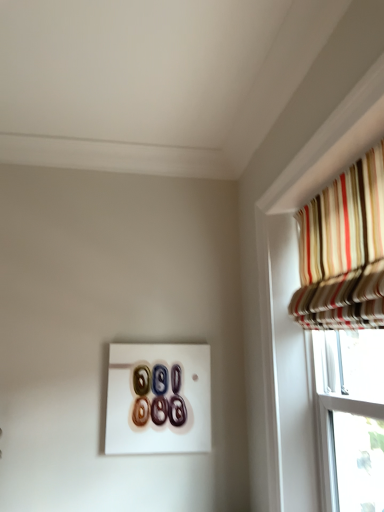
Question: Is glossy ceramic buttons at center touching striped fabric curtain at upper right?

Choices:
 (A) no
 (B) yes

Answer: (A)

Question: From a real-world perspective, is glossy ceramic buttons at center physically below striped fabric curtain at upper right?

Choices:
 (A) yes
 (B) no

Answer: (A)

Question: Considering the relative sizes of glossy ceramic buttons at center and striped fabric curtain at upper right in the image provided, is glossy ceramic buttons at center shorter than striped fabric curtain at upper right?

Choices:
 (A) no
 (B) yes

Answer: (B)

Question: Could striped fabric curtain at upper right be considered to be inside glossy ceramic buttons at center?

Choices:
 (A) yes
 (B) no

Answer: (B)

Question: Is glossy ceramic buttons at center taller than striped fabric curtain at upper right?

Choices:
 (A) no
 (B) yes

Answer: (A)

Question: Is the depth of glossy ceramic buttons at center less than that of striped fabric curtain at upper right?

Choices:
 (A) no
 (B) yes

Answer: (A)

Question: From the image's perspective, is striped fabric curtain at upper right over glossy ceramic buttons at center?

Choices:
 (A) no
 (B) yes

Answer: (B)

Question: Considering the relative sizes of striped fabric curtain at upper right and glossy ceramic buttons at center in the image provided, is striped fabric curtain at upper right wider than glossy ceramic buttons at center?

Choices:
 (A) yes
 (B) no

Answer: (A)

Question: Is the depth of striped fabric curtain at upper right greater than that of glossy ceramic buttons at center?

Choices:
 (A) no
 (B) yes

Answer: (A)

Question: Is striped fabric curtain at upper right located outside glossy ceramic buttons at center?

Choices:
 (A) yes
 (B) no

Answer: (A)

Question: Would you say striped fabric curtain at upper right is a long distance from glossy ceramic buttons at center?

Choices:
 (A) yes
 (B) no

Answer: (A)

Question: Considering the relative sizes of striped fabric curtain at upper right and glossy ceramic buttons at center in the image provided, is striped fabric curtain at upper right taller than glossy ceramic buttons at center?

Choices:
 (A) yes
 (B) no

Answer: (A)

Question: Is striped fabric curtain at upper right bigger or smaller than glossy ceramic buttons at center?

Choices:
 (A) small
 (B) big

Answer: (B)